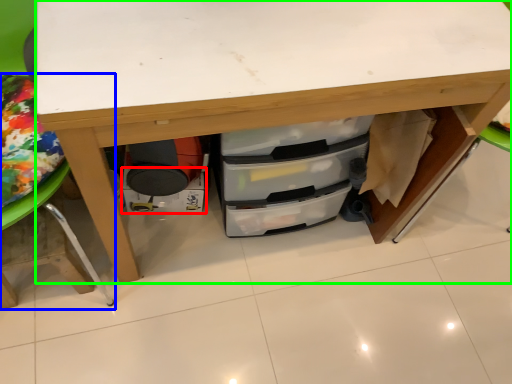
Question: Which object is the closest to the drawer (highlighted by a red box)? Choose among these: furniture (highlighted by a blue box) or desk (highlighted by a green box).

Choices:
 (A) furniture
 (B) desk

Answer: (A)